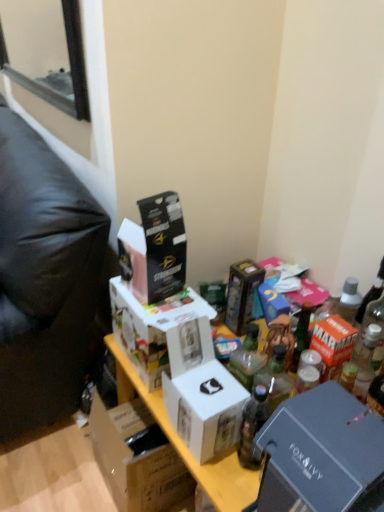
Question: From a real-world perspective, is clear glass bottle at upper right, the 1th bottle from the top, physically located above or below metallic gold box at center, positioned as the second box in top-to-bottom order?

Choices:
 (A) below
 (B) above

Answer: (B)

Question: Does point (382, 276) appear closer or farther from the camera than point (226, 321)?

Choices:
 (A) farther
 (B) closer

Answer: (B)

Question: Which object is the farthest from the white cardboard box at center, the first box ordered from the bottom?

Choices:
 (A) black cardboard box at upper center, the 1th box from the top
 (B) white cardboard box at center, the 3th box viewed from the top
 (C) metallic gray box at lower right, the 5th box when ordered from top to bottom
 (D) translucent glass bottle at center, acting as the 1th bottle starting from the left
 (E) clear glass bottle at upper right, the 2th bottle when ordered from bottom to top

Answer: (E)

Question: Considering the real-world distances, which object is farthest from the black leather bean bag at left?

Choices:
 (A) metallic gold box at center, acting as the 5th box starting from the bottom
 (B) metallic gray box at lower right, the second box ordered from the bottom
 (C) white cardboard box at center, the 4th box viewed from the top
 (D) clear glass bottle at upper right, the first bottle positioned from the right
 (E) black cardboard box at upper center, the sixth box when ordered from bottom to top

Answer: (D)